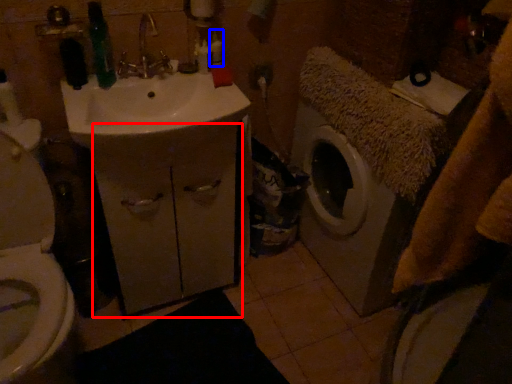
Question: Which point is further to the camera, drawer (highlighted by a red box) or toiletry (highlighted by a blue box)?

Choices:
 (A) drawer
 (B) toiletry

Answer: (B)